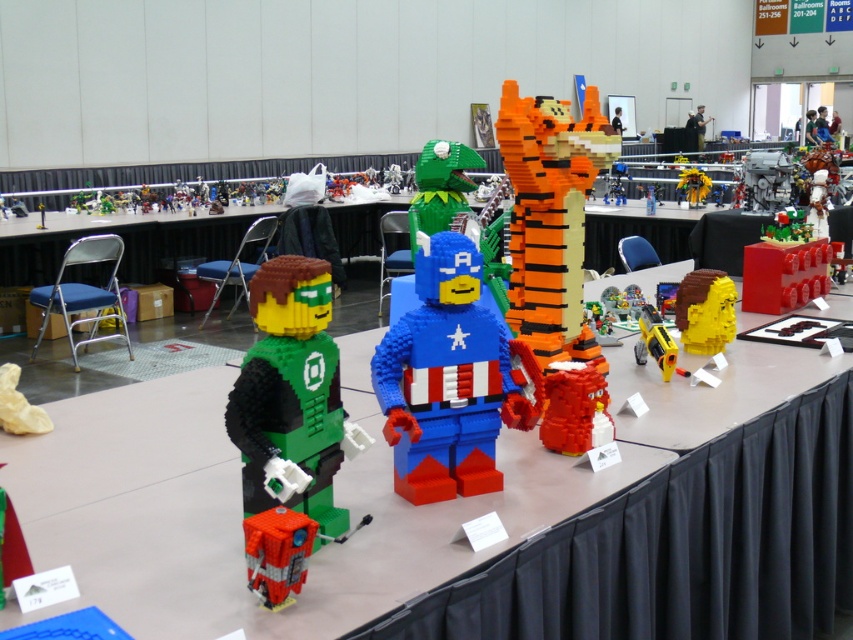
Question: Which is farther from the bright red plastic bricks at center right?

Choices:
 (A) matte gray engine at center
 (B) brown matte head at center
 (C) yellow matte tiger at center

Answer: (C)

Question: Can you confirm if brick red lego brick at center is smaller than brown matte head at center?

Choices:
 (A) no
 (B) yes

Answer: (B)

Question: Which of the following is the farthest from the observer?

Choices:
 (A) 189,467
 (B) 254,301
 (C) 662,340
 (D) 750,161

Answer: (D)

Question: Considering the relative positions of green matte lego figure at center and brown matte head at center in the image provided, where is green matte lego figure at center located with respect to brown matte head at center?

Choices:
 (A) left
 (B) right

Answer: (A)

Question: Which object appears farthest from the camera in this image?

Choices:
 (A) yellow matte tiger at center
 (B) bright red plastic bricks at center right
 (C) green matte lego dragon at center

Answer: (A)

Question: From the image, what is the correct spatial relationship of matte gray engine at center in relation to yellow plastic gun at center?

Choices:
 (A) left
 (B) right

Answer: (B)